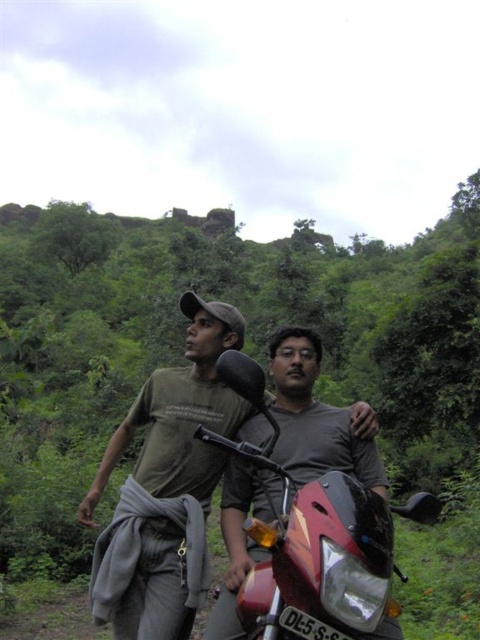
You are standing at the point marked by the coordinates point (245,349). Looking around, you notice two people and a red motorbike. Which direction should you walk to reach the red motorbike?

The green leafy vegetation at center is represented by point (245,349). Since the motorbike is prominently featured in the foreground, you should walk forward from the point to reach the red motorbike.

Based on the coordinates provided, where is the green leafy vegetation at center located in the image?

The green leafy vegetation at center is located at the 2D coordinates point (245, 349) in the image.

You are planning to take a photo of the shiny red motorcycle at center. However, there is green leafy vegetation at center blocking the view. Can you determine if the vegetation is wider than the motorcycle?

The green leafy vegetation at center might be wider than shiny red motorcycle at center, so it could block the view of the motorcycle. You may need to move the vegetation or adjust your angle to get a clear shot of the motorcycle.